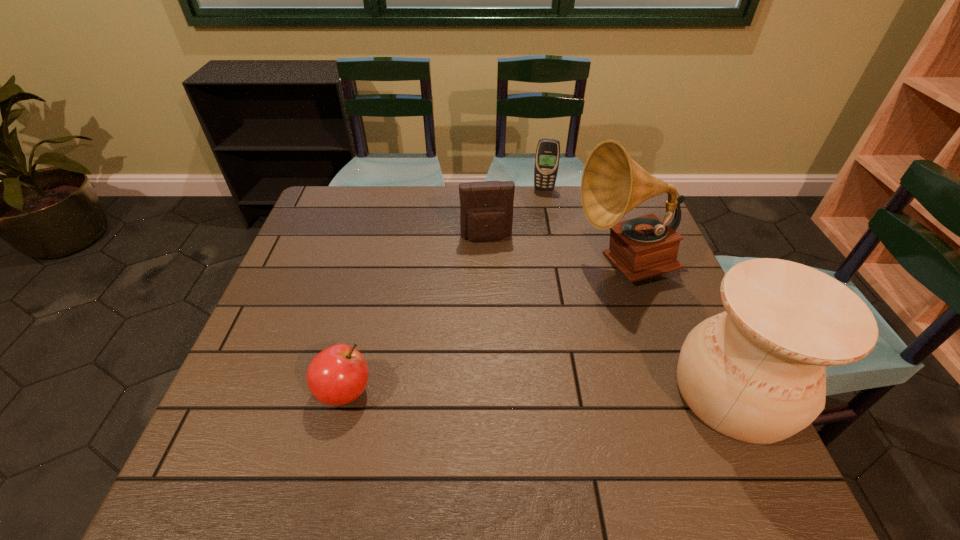
Locate an element on the screen. The image size is (960, 540). vacant region that satisfies the following two spatial constraints: 1. on the front side of the second tallest object; 2. at the open side of the farthest object is located at coordinates (582, 392).